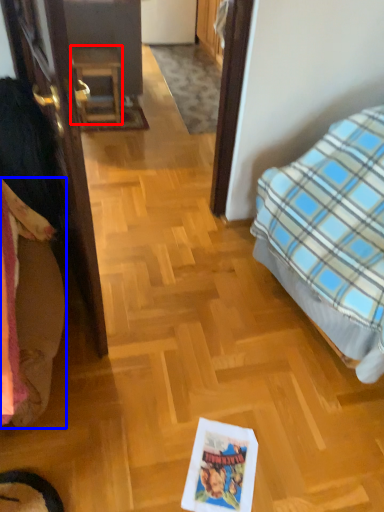
Question: Which point is closer to the camera, furniture (highlighted by a red box) or bedding (highlighted by a blue box)?

Choices:
 (A) furniture
 (B) bedding

Answer: (B)